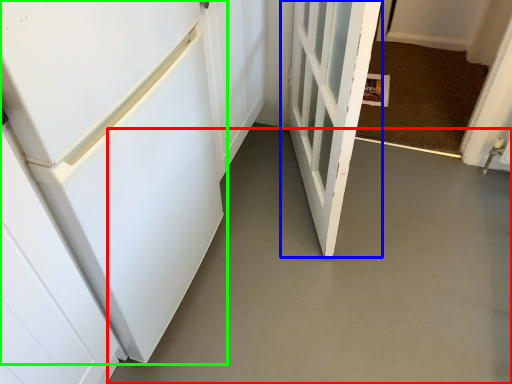
Question: Which is farther away from concrete (highlighted by a red box)? door (highlighted by a blue box) or door (highlighted by a green box)?

Choices:
 (A) door
 (B) door

Answer: (B)